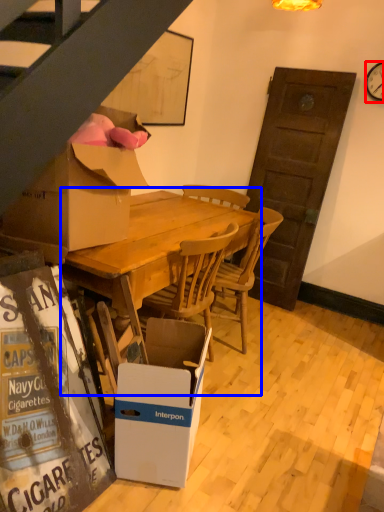
Question: Which point is further to the camera, clock (highlighted by a red box) or round table (highlighted by a blue box)?

Choices:
 (A) clock
 (B) round table

Answer: (A)